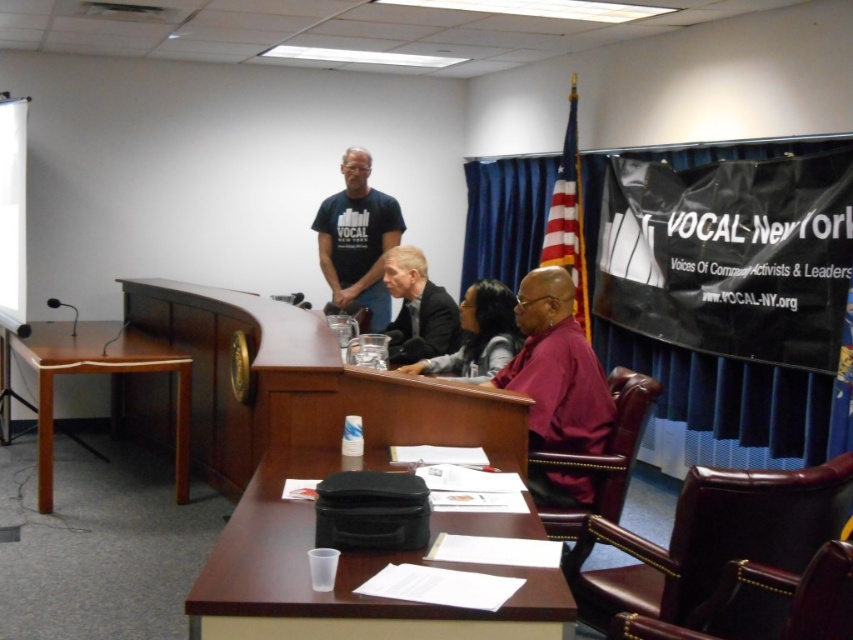
Between brown wooden table at left and matte black jacket at center, which one appears on the left side from the viewer's perspective?

brown wooden table at left

Is point (42, 477) behind point (483, 321)?

Yes.

Find the location of a particular element. brown wooden table at left is located at coordinates (99, 372).

Is point (112, 355) positioned before point (360, 188)?

Yes.

Which is behind, point (38, 506) or point (381, 305)?

The point (381, 305) is more distant.

Image resolution: width=853 pixels, height=640 pixels. I want to click on brown wooden table at left, so click(x=99, y=372).

Does black t-shirt at center have a smaller size compared to dark suit at center?

No.

Does point (363, 230) come behind point (403, 358)?

Yes, point (363, 230) is behind point (403, 358).

Locate an element on the screen. This screenshot has height=640, width=853. black t-shirt at center is located at coordinates (357, 241).